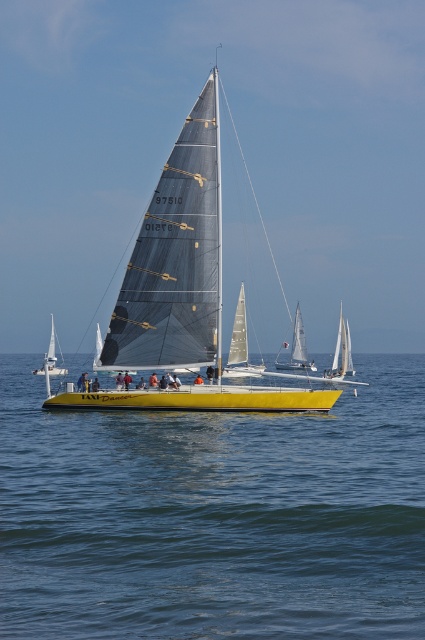
What do you see at coordinates (180, 292) in the screenshot? I see `yellow matte sailboat at center` at bounding box center [180, 292].

Between point (173, 365) and point (34, 372), which one is positioned in front?

Positioned in front is point (173, 365).

Looking at this image, who is more distant from viewer, [121,323] or [57,369]?

Point [57,369]

Where is `yellow matte sailboat at center`? yellow matte sailboat at center is located at coordinates (180, 292).

Is point (308, 486) positioned after point (217, 246)?

No, it is not.

Is clear blue water at center taller than yellow matte sailboat at center?

Incorrect, clear blue water at center's height is not larger of yellow matte sailboat at center's.

Where is `clear blue water at center`? clear blue water at center is located at coordinates (215, 516).

You are a GUI agent. You are given a task and a screenshot of the screen. Output one action in this format:
    pyautogui.click(x=<x>, y=<y>)
    Task: Click on the clear blue water at center
    The height and width of the screenshot is (640, 425).
    Given the screenshot: What is the action you would take?
    pyautogui.click(x=215, y=516)

Can you confirm if clear blue water at center is positioned below white matte sailboat at lower left?

Correct, clear blue water at center is located below white matte sailboat at lower left.

Where is `clear blue water at center`? The height and width of the screenshot is (640, 425). clear blue water at center is located at coordinates (215, 516).

Which is behind, point (288, 436) or point (54, 365)?

Positioned behind is point (54, 365).

At what (x,y) coordinates should I click in order to perform the action: click on clear blue water at center. Please return your answer as a coordinate pair (x, y). The width and height of the screenshot is (425, 640). Looking at the image, I should click on (215, 516).